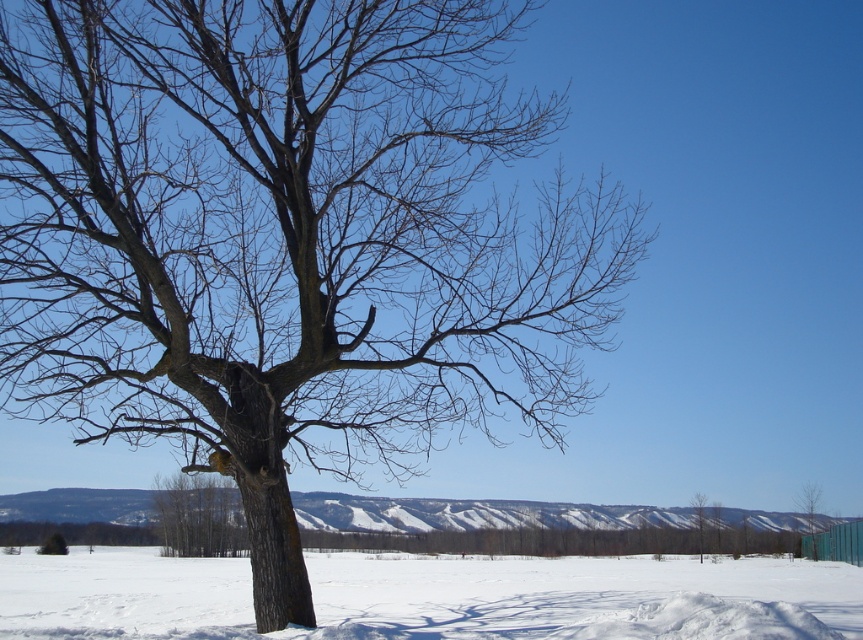
You are standing in the winter landscape and want to walk from the green matte tree at lower right to the green matte tree at right. Which direction should you face to walk directly towards the destination?

You should face to the right direction because the green matte tree at right is located to the right of the green matte tree at lower right.

You are an observer standing in the snow near the large tree. You notice two smaller green matte trees in the distance. Which of the two, the green matte tree at right or the green matte tree at lower right, appears to have a greater width from your viewpoint?

The green matte tree at right might be wider than the green matte tree at lower right according to the description.